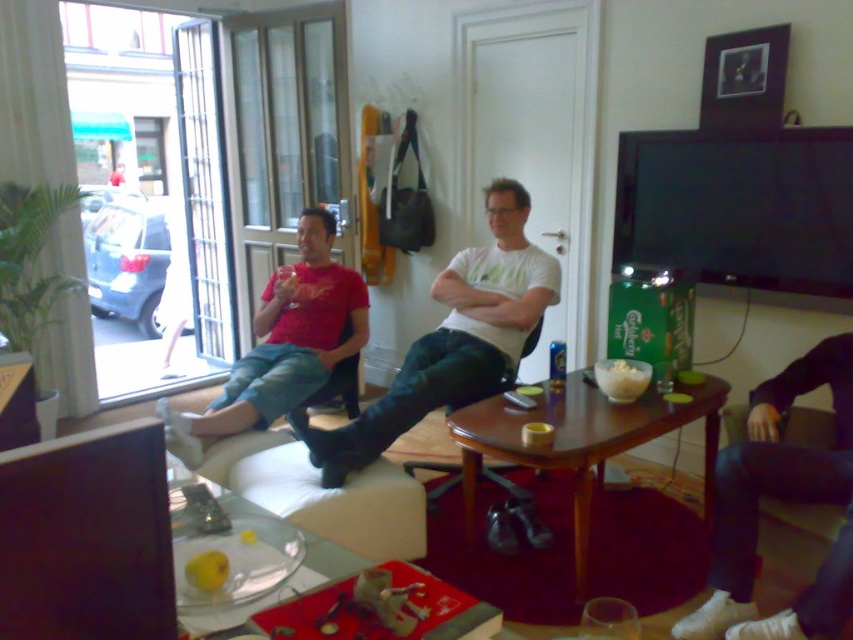
Question: Which object is closer to the camera taking this photo?

Choices:
 (A) brown wooden table at center
 (B) matte red shirt at left

Answer: (A)

Question: Can you confirm if matte red shirt at left is wider than leather armchair at center?

Choices:
 (A) yes
 (B) no

Answer: (A)

Question: Can you confirm if white matte t-shirt at center is wider than white fabric couch at lower center?

Choices:
 (A) no
 (B) yes

Answer: (B)

Question: Is matte red shirt at left closer to camera compared to leather armchair at center?

Choices:
 (A) no
 (B) yes

Answer: (B)

Question: Which point is farther to the camera?

Choices:
 (A) (201, 449)
 (B) (448, 468)
 (C) (215, 444)
 (D) (379, 400)

Answer: (D)

Question: Which point is farther to the camera?

Choices:
 (A) white fabric couch at lower center
 (B) matte red shirt at left
 (C) brown wooden table at center

Answer: (B)